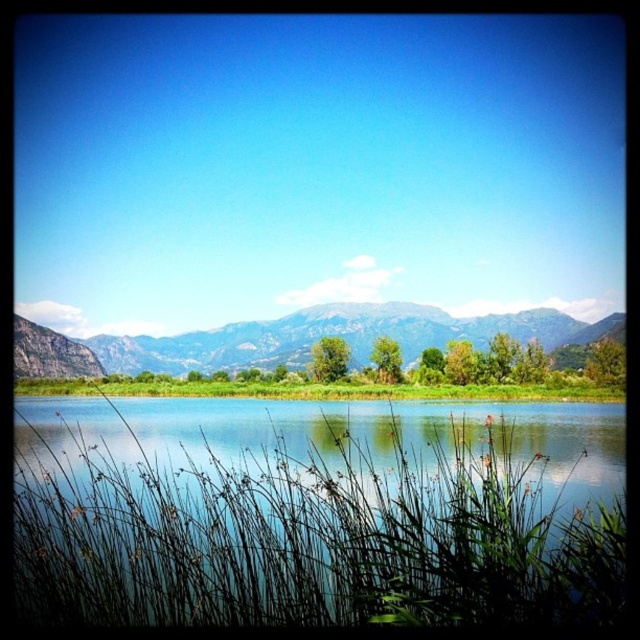
You are standing at the point labeled point [404,442] and want to walk towards the point labeled point [401,394]. According to the scene description, will you be moving towards the foreground or the background?

Since point [404,442] is closer to the camera than point [401,394], moving from point [404,442] to point [401,394] means you are moving away from the camera, which corresponds to moving towards the background of the scene.

You are standing at the edge of the water and notice the rocky gray mountain at center and the green grass at center. Which object is located to the right of the other?

The rocky gray mountain at center is positioned on the right side of green grass at center.